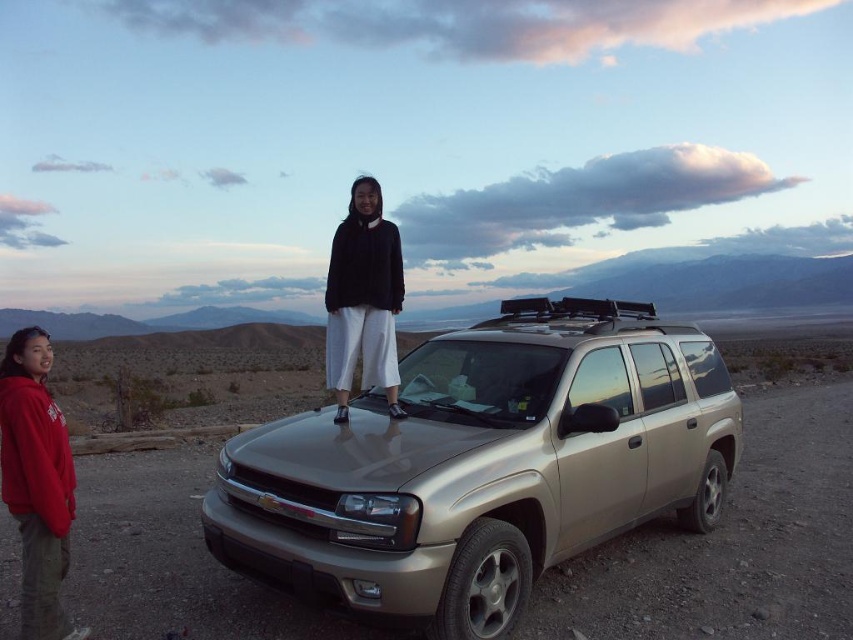
Question: Can you confirm if satin gold suv at center is positioned to the left of red fleece jacket at lower left?

Choices:
 (A) yes
 (B) no

Answer: (B)

Question: Considering the relative positions of satin gold suv at center and black matte sweater at center in the image provided, where is satin gold suv at center located with respect to black matte sweater at center?

Choices:
 (A) right
 (B) left

Answer: (A)

Question: Is satin gold suv at center thinner than red fleece jacket at lower left?

Choices:
 (A) no
 (B) yes

Answer: (A)

Question: Which of the following is the closest to the observer?

Choices:
 (A) satin gold suv at center
 (B) red fleece jacket at lower left
 (C) black matte sweater at center

Answer: (A)

Question: Which point appears farthest from the camera in this image?

Choices:
 (A) (39, 624)
 (B) (357, 266)
 (C) (682, 412)

Answer: (C)

Question: Which point is farther to the camera?

Choices:
 (A) red fleece jacket at lower left
 (B) black matte sweater at center
 (C) satin gold suv at center

Answer: (B)